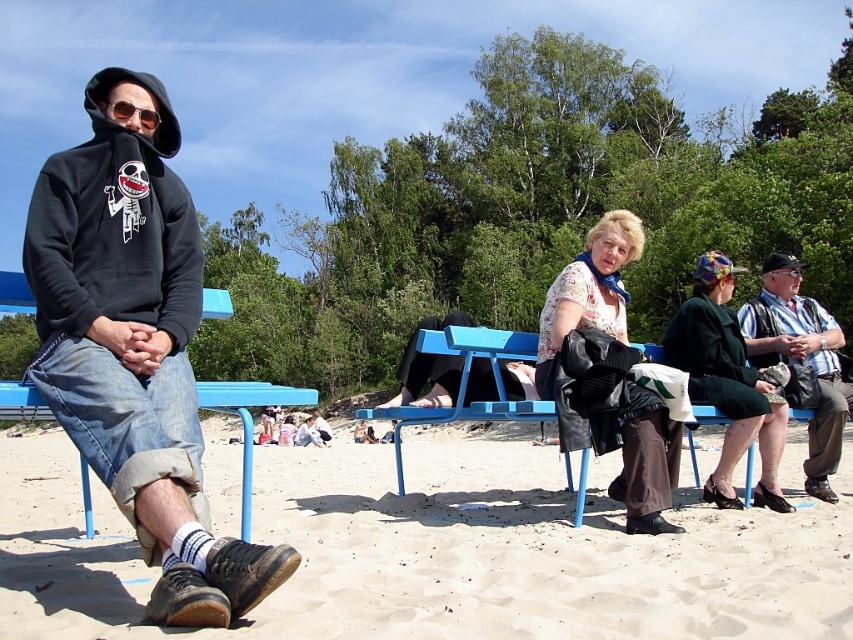
You are a photographer trying to capture a clear shot of the matte black hoodie at center and the blue plastic bench at center. Which object should you focus on first if you want to ensure both are in focus without adjusting your camera settings?

The matte black hoodie at center is taller than the blue plastic bench at center, so you should focus on the matte black hoodie at center first to ensure both are in focus.